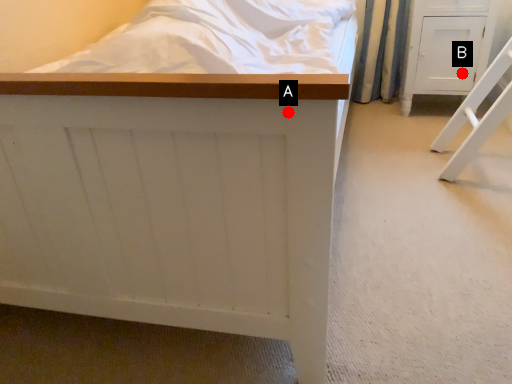
Question: Two points are circled on the image, labeled by A and B beside each circle. Which point is farther to the camera?

Choices:
 (A) A is further
 (B) B is further

Answer: (B)